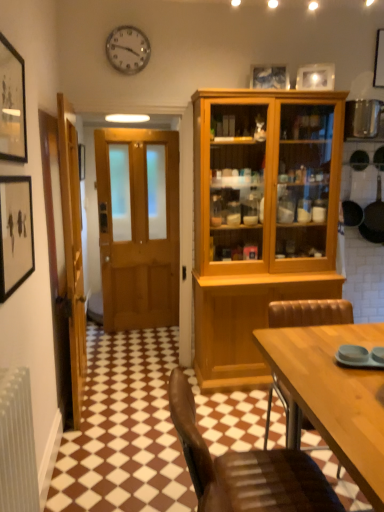
Question: Is brown leather chair at lower center, the 2th chair from the back, wider or thinner than matte wooden picture frame at upper center, the 2th picture frame from the back?

Choices:
 (A) wide
 (B) thin

Answer: (A)

Question: From a real-world perspective, is brown leather chair at lower center, which is counted as the 1th chair, starting from the front, above or below matte wooden picture frame at upper center, positioned as the third picture frame in left-to-right order?

Choices:
 (A) above
 (B) below

Answer: (B)

Question: Which object is positioned closest to the matte wooden picture frame at upper center, the 2th picture frame from the back?

Choices:
 (A) brown leather chair at lower right, which is the 2th chair in front-to-back order
 (B) wooden picture frame at upper left, placed as the third picture frame when sorted from top to bottom
 (C) black non-stick frying pan at right
 (D) white glossy picture frame at upper center, which is the fourth picture frame from front to back
 (E) brown leather chair at lower center, which is counted as the 1th chair, starting from the front

Answer: (D)

Question: Which object is the farthest from the metallic clock at upper center?

Choices:
 (A) white glossy picture frame at upper center, positioned as the first picture frame in right-to-left order
 (B) brown leather chair at lower center, which is counted as the 1th chair, starting from the front
 (C) matte wooden picture frame at upper center, which is the fourth picture frame from bottom to top
 (D) matte black picture frame at left, which is the third picture frame from back to front
 (E) wooden picture frame at upper left, the 1th picture frame when ordered from front to back

Answer: (B)